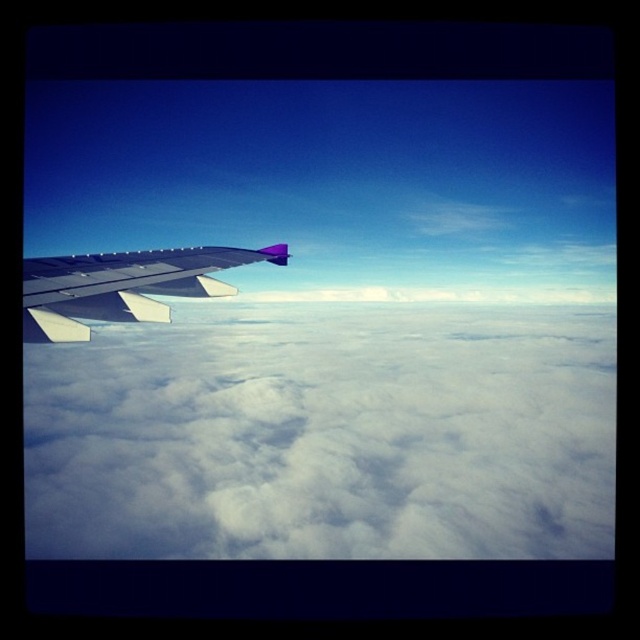
Between white fluffy cloud at left and metallic silver wing at left, which one is positioned higher?

metallic silver wing at left is higher up.

Does point (612, 488) lie in front of point (84, 264)?

No, (612, 488) is behind (84, 264).

Identify the location of white fluffy cloud at left. (324, 435).